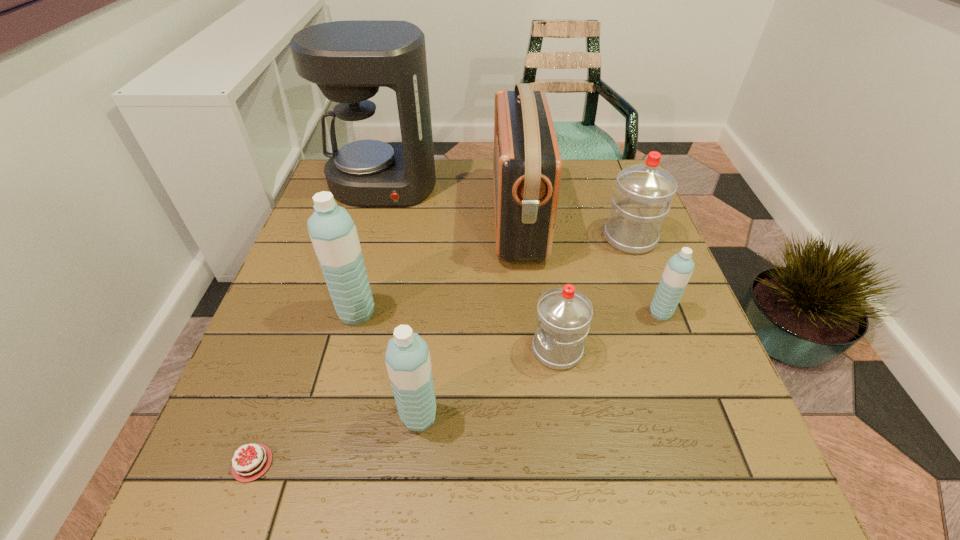
Locate an element on the screen. coffee maker is located at coordinates (348, 60).

Locate an element on the screen. dark coffee maker is located at coordinates (348, 60).

I want to click on radio receiver, so click(527, 165).

I want to click on the leftmost blue water bottle, so click(333, 233).

Image resolution: width=960 pixels, height=540 pixels. I want to click on the biggest blue water bottle, so click(x=333, y=233).

The width and height of the screenshot is (960, 540). Find the location of `the farther white water bottle`. the farther white water bottle is located at coordinates (643, 193).

The height and width of the screenshot is (540, 960). Identify the location of the bigger white water bottle. (643, 193).

Identify the location of the second water bottle from left to right. (x=408, y=362).

Image resolution: width=960 pixels, height=540 pixels. In order to click on the second blue water bottle from right to left in this screenshot , I will do `click(408, 362)`.

The height and width of the screenshot is (540, 960). Find the location of `the smallest blue water bottle`. the smallest blue water bottle is located at coordinates (678, 270).